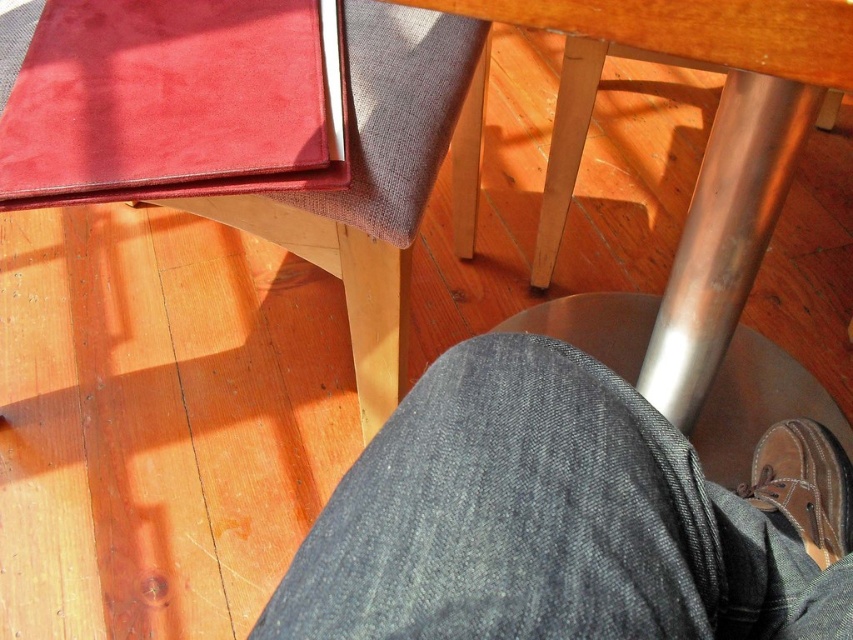
You are sitting at the table and want to kick your shoe towards a specific spot. The coordinates of the target spots are point (813, 424) and point (758, 502). Which coordinate corresponds to the spot that is further away from your current position?

Point (813, 424) is behind point (758, 502), so the spot at point (813, 424) is further away from your current position.

Based on the photo, you are sitting at the table and want to check if your dark blue denim jeans at lower center are covering your brown leather shoe at lower right. Based on the scene, can you confirm this?

The dark blue denim jeans at lower center is positioned over brown leather shoe at lower right, so yes, the jeans are covering the shoe.